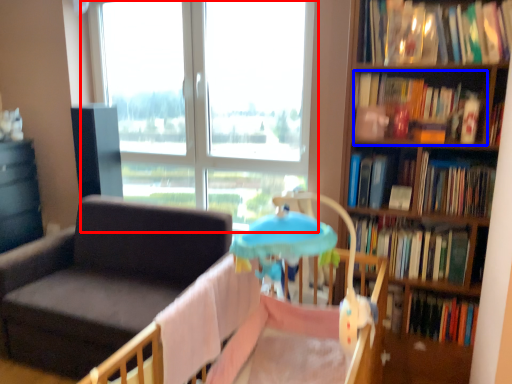
Question: Which object is further to the camera taking this photo, window (highlighted by a red box) or book (highlighted by a blue box)?

Choices:
 (A) window
 (B) book

Answer: (A)